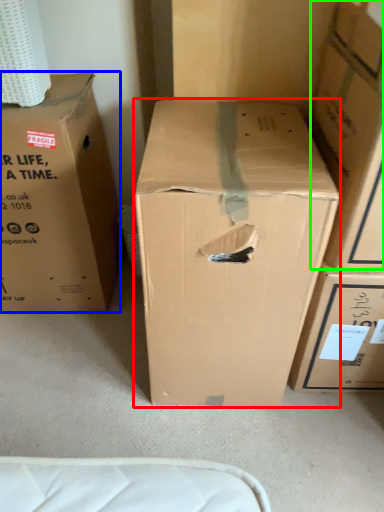
Question: Estimate the real-world distances between objects in this image. Which object is closer to box (highlighted by a red box), box (highlighted by a blue box) or box (highlighted by a green box)?

Choices:
 (A) box
 (B) box

Answer: (B)